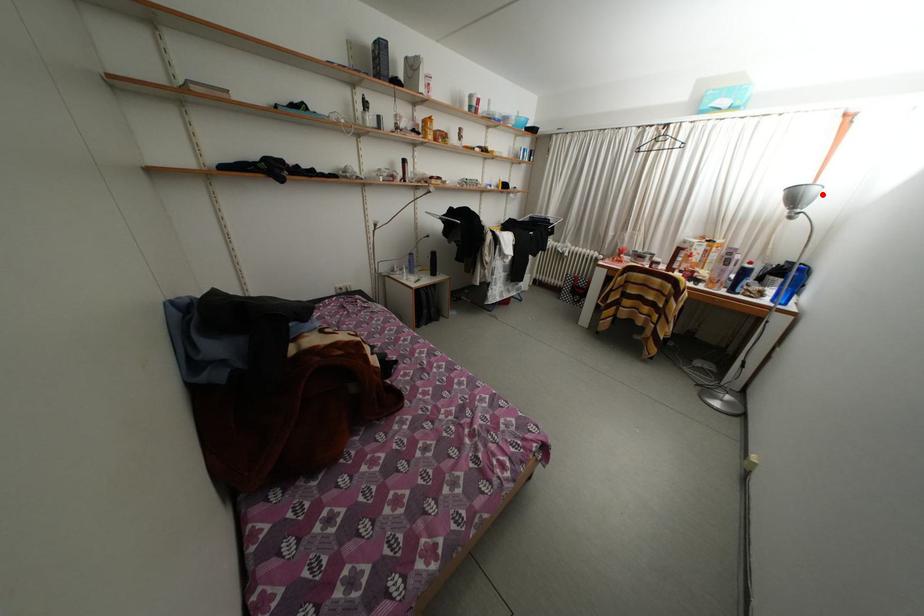
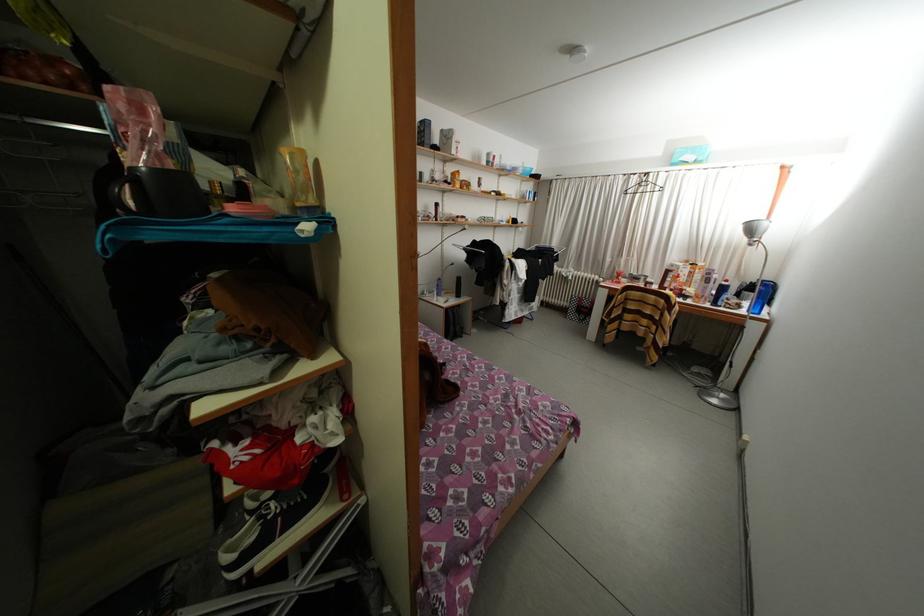
Find the pixel in the second image that matches the highlighted location in the first image.

(772, 229)